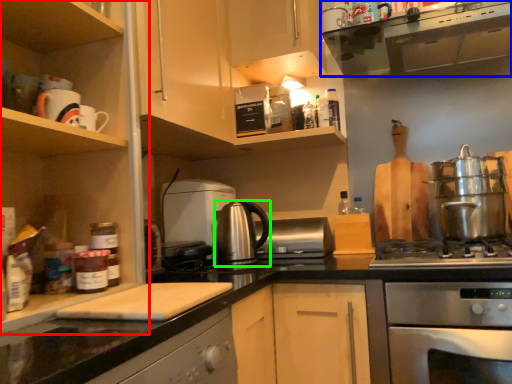
Question: Which object is the farthest from cabinetry (highlighted by a red box)? Choose among these: home appliance (highlighted by a blue box) or kitchen appliance (highlighted by a green box).

Choices:
 (A) home appliance
 (B) kitchen appliance

Answer: (A)